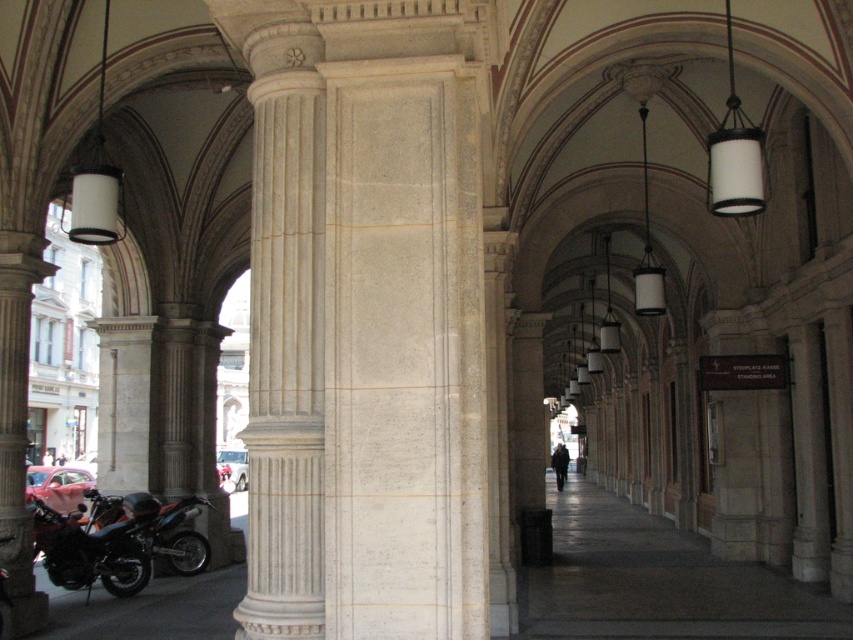
You are standing in the grand arcade and want to know the distance to a specific point marked as point [82,508]. Can you tell me how far it is from where you are standing?

The point [82,508] is 24.25 meters away from the viewer.

You are standing in the arcade and want to park your new motorcycle. You see an orange metallic motorcycle at lower left and a shiny metallic motorcycle at lower left. Which motorcycle should you park to the right of to maintain alignment with the existing vehicles?

You should park to the right of the shiny metallic motorcycle at lower left because the orange metallic motorcycle at lower left is already positioned to its left, maintaining the existing alignment.